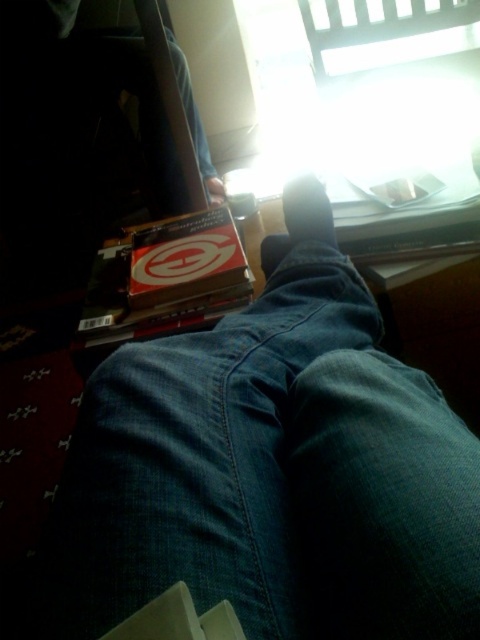
You are trying to fit a pair of dark blue denim jeans at center into a drawer. The drawer has a width of 40 cm. The matte black foot at lower center is 25 cm wide. Can the jeans fit in the drawer?

The dark blue denim jeans at center might be wider than the matte black foot at lower center, which is 25 cm wide. Since the drawer is 40 cm wide, the jeans could potentially fit if their width is less than 40 cm. However, without knowing the exact width of the jeans, it is uncertain.